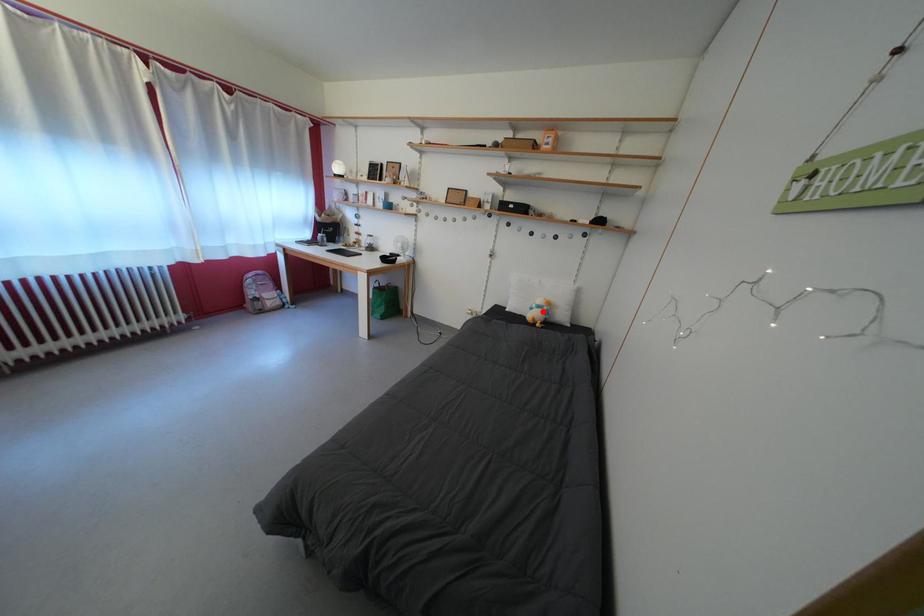
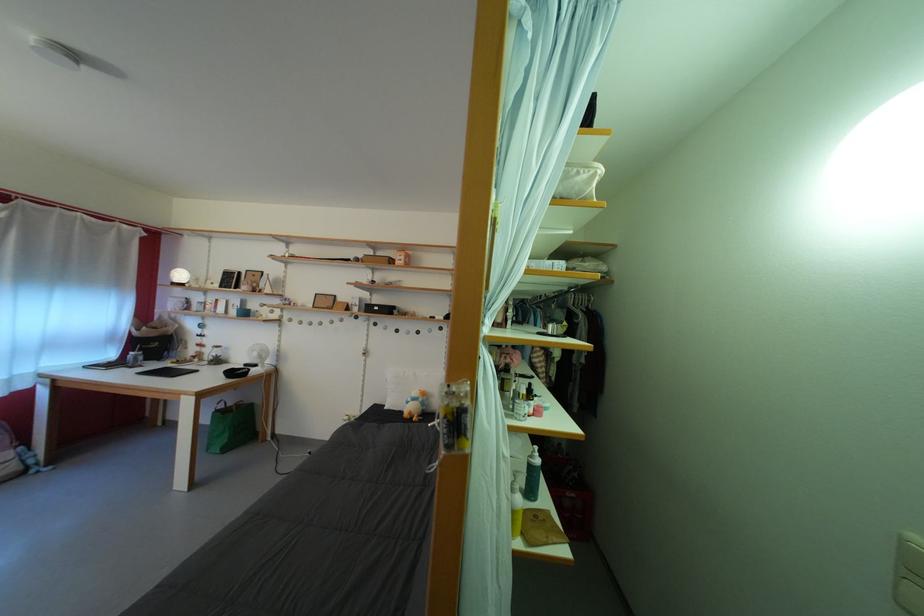
Question: I am providing you with two images of the same scene from different viewpoints. Image1 has a red point marked. In image2, the corresponding 3D location appears at what relative position? Reply with the corresponding letter.

Choices:
 (A) Closer
 (B) Farther

Answer: (B)